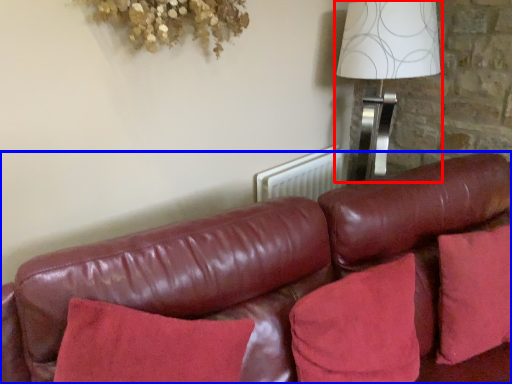
Question: Which object is closer to the camera taking this photo, table lamp (highlighted by a red box) or studio couch (highlighted by a blue box)?

Choices:
 (A) table lamp
 (B) studio couch

Answer: (B)